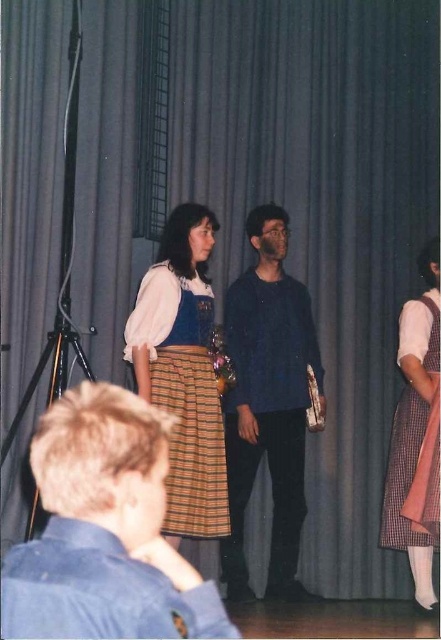
Does blue cotton shirt at center have a smaller size compared to matte white blouse at center?

Indeed, blue cotton shirt at center has a smaller size compared to matte white blouse at center.

Can you confirm if blue cotton shirt at center is positioned below matte white blouse at center?

Correct, blue cotton shirt at center is located below matte white blouse at center.

Who is more forward, (153, 579) or (191, 365)?

Positioned in front is point (153, 579).

Find the location of `blue cotton shirt at center`. blue cotton shirt at center is located at coordinates (104, 531).

Does dark blue sweater at center appear on the right side of checkered fabric dress at right?

Incorrect, dark blue sweater at center is not on the right side of checkered fabric dress at right.

Consider the image. Between dark blue sweater at center and checkered fabric dress at right, which one appears on the left side from the viewer's perspective?

dark blue sweater at center is more to the left.

Which is in front, point (284, 214) or point (403, 518)?

Point (403, 518) is more forward.

The image size is (441, 640). I want to click on dark blue sweater at center, so click(x=268, y=401).

Does dark blue sweater at center have a greater width compared to matte white blouse at center?

Yes, dark blue sweater at center is wider than matte white blouse at center.

Between point (230, 499) and point (172, 259), which one is positioned behind?

Positioned behind is point (230, 499).

Image resolution: width=441 pixels, height=640 pixels. In order to click on dark blue sweater at center in this screenshot , I will do `click(268, 401)`.